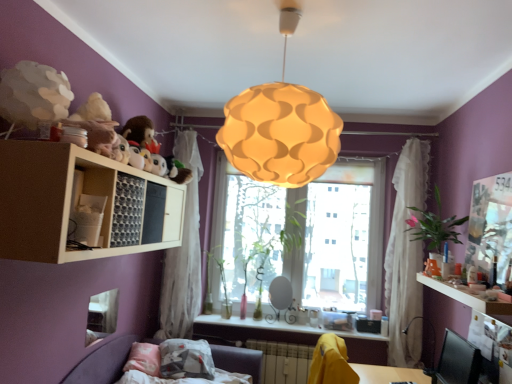
Question: Considering the relative sizes of metallic silver table lamp at lower right and white sheer curtain at left, placed as the 1th curtain when sorted from left to right, in the image provided, is metallic silver table lamp at lower right smaller than white sheer curtain at left, placed as the 1th curtain when sorted from left to right,?

Choices:
 (A) yes
 (B) no

Answer: (A)

Question: Would you say metallic silver table lamp at lower right is a long distance from white sheer curtain at left, placed as the 1th curtain when sorted from left to right?

Choices:
 (A) no
 (B) yes

Answer: (B)

Question: Is metallic silver table lamp at lower right wider than white sheer curtain at left, placed as the 1th curtain when sorted from left to right?

Choices:
 (A) no
 (B) yes

Answer: (B)

Question: From the image's perspective, does metallic silver table lamp at lower right appear higher than white sheer curtain at left, the second curtain viewed from the right?

Choices:
 (A) yes
 (B) no

Answer: (B)

Question: Considering the relative sizes of metallic silver table lamp at lower right and white sheer curtain at left, the second curtain viewed from the right, in the image provided, is metallic silver table lamp at lower right bigger than white sheer curtain at left, the second curtain viewed from the right,?

Choices:
 (A) yes
 (B) no

Answer: (B)

Question: From the image's perspective, is white matte shelf at upper left above or below fluffy plush toys at upper left?

Choices:
 (A) above
 (B) below

Answer: (B)

Question: In the image, is white matte shelf at upper left on the left side or the right side of fluffy plush toys at upper left?

Choices:
 (A) right
 (B) left

Answer: (A)

Question: In terms of width, does white matte shelf at upper left look wider or thinner when compared to fluffy plush toys at upper left?

Choices:
 (A) thin
 (B) wide

Answer: (B)

Question: Is white matte shelf at upper left taller or shorter than fluffy plush toys at upper left?

Choices:
 (A) tall
 (B) short

Answer: (A)

Question: Does point (265, 324) appear closer or farther from the camera than point (388, 261)?

Choices:
 (A) farther
 (B) closer

Answer: (A)

Question: Considering the positions of matte white shelf at lower center, which ranks as the 2th counter top in right-to-left order, and white sheer curtain at right, placed as the 2th curtain when sorted from left to right, in the image, is matte white shelf at lower center, which ranks as the 2th counter top in right-to-left order, bigger or smaller than white sheer curtain at right, placed as the 2th curtain when sorted from left to right,?

Choices:
 (A) small
 (B) big

Answer: (A)

Question: From the image's perspective, relative to white sheer curtain at right, placed as the 2th curtain when sorted from left to right, is matte white shelf at lower center, which is the second counter top from top to bottom, above or below?

Choices:
 (A) below
 (B) above

Answer: (A)

Question: Is matte white shelf at lower center, positioned as the 2th counter top in front-to-back order, inside the boundaries of white sheer curtain at right, placed as the 2th curtain when sorted from left to right, or outside?

Choices:
 (A) outside
 (B) inside

Answer: (A)

Question: Is green matte plant at window, positioned as the first plant in back-to-front order, in front of or behind matte white shelf at lower center, positioned as the 2th counter top in front-to-back order, in the image?

Choices:
 (A) behind
 (B) front

Answer: (A)

Question: In terms of size, does green matte plant at window, positioned as the first plant in back-to-front order, appear bigger or smaller than matte white shelf at lower center, which ranks as the 2th counter top in right-to-left order?

Choices:
 (A) small
 (B) big

Answer: (B)